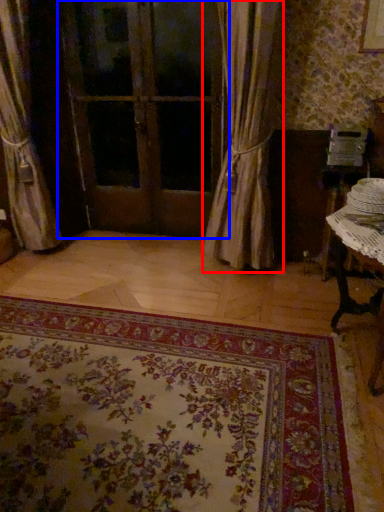
Question: Among these objects, which one is nearest to the camera, curtain (highlighted by a red box) or door (highlighted by a blue box)?

Choices:
 (A) curtain
 (B) door

Answer: (A)